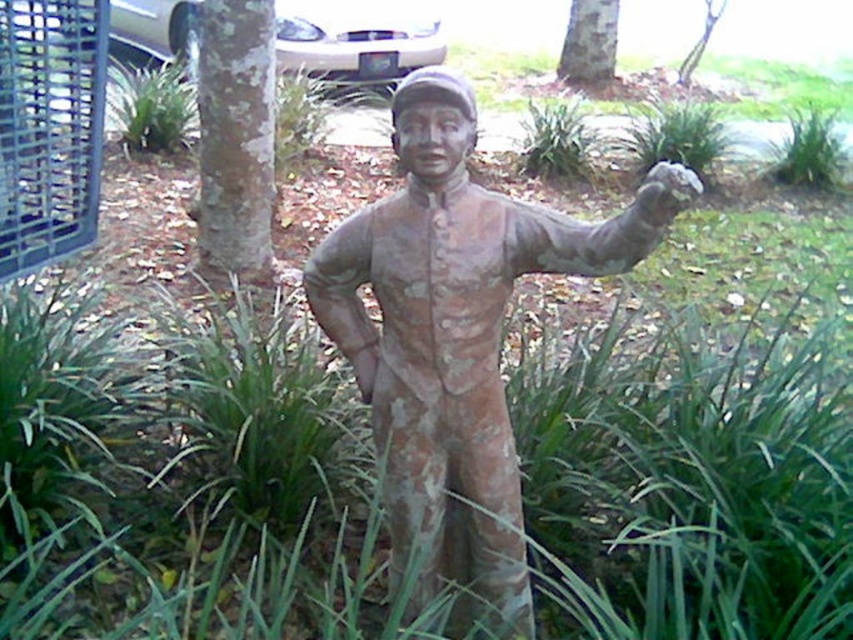
You are a gardener who needs to water the brown rough bark at center. The rusty bronze statue at center is in the way. Can you move the statue to access the bark?

The rusty bronze statue at center is below brown rough bark at center, so you can move the statue to access the bark because it is positioned underneath it.

You are a landscape architect designing a garden layout. You need to place a new bench between the rusty bronze statue at center and the smooth bark tree at center. Since the bench requires a minimum of 2 meters of space between the two objects, will there be enough space?

The rusty bronze statue at center is bigger than the smooth bark tree at center, but the description does not provide specific measurements of their sizes or the distance between them. Therefore, it is impossible to determine if the 2 meters of space required for the bench is available.

In the scene shown: You are standing in the garden where the bronze statue is located. You want to place a small flower pot at a specific point marked as point (462, 317). If you are currently 1.5 meters away from the statue, can you reach the point without moving closer to the statue?

The distance of point (462, 317) from viewer is 1.29 meters, so yes, you can reach the point without moving closer since it is within your current distance of 1.5 meters from the statue.